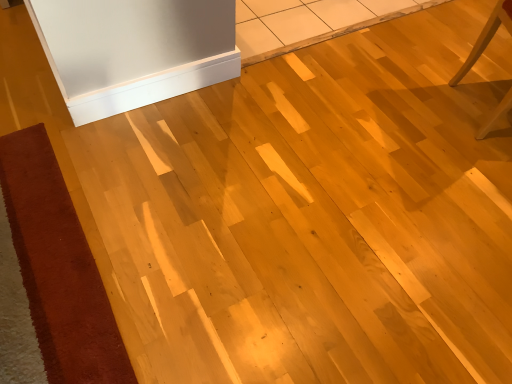
Locate an element on the screen. free location in front of light wood chair at right is located at coordinates (471, 170).